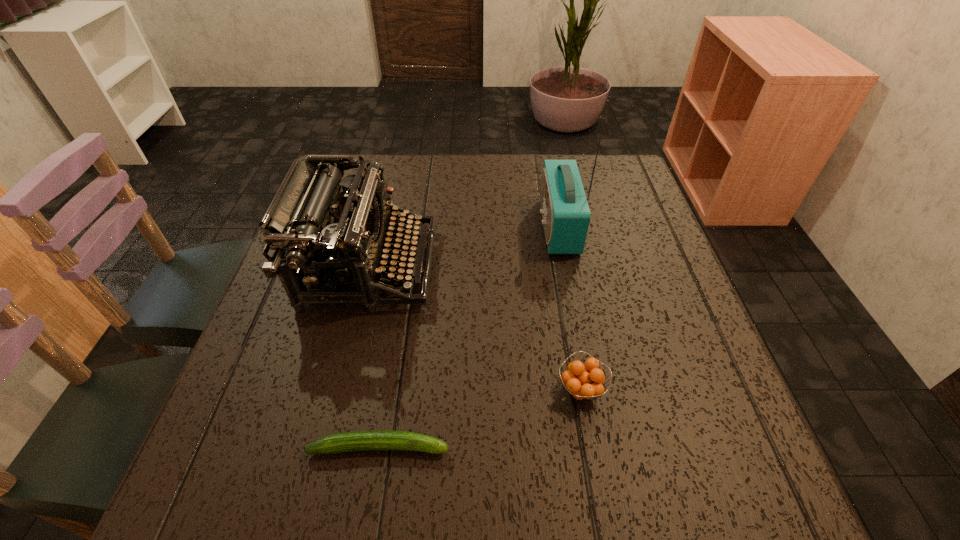
Identify the location of object that ranks as the third closest to the tallest object. (358, 440).

This screenshot has width=960, height=540. I want to click on object that is the third closest to the third shortest object, so click(x=584, y=382).

Where is `vacant space that satisfies the following two spatial constraints: 1. on the front side of the second nearest object; 2. on the front-facing side of the shortest object`? Image resolution: width=960 pixels, height=540 pixels. vacant space that satisfies the following two spatial constraints: 1. on the front side of the second nearest object; 2. on the front-facing side of the shortest object is located at coordinates (591, 447).

The width and height of the screenshot is (960, 540). Find the location of `free space in the image that satisfies the following two spatial constraints: 1. on the typing side of the second tallest object; 2. on the right side of the second nearest object`. free space in the image that satisfies the following two spatial constraints: 1. on the typing side of the second tallest object; 2. on the right side of the second nearest object is located at coordinates (339, 389).

Where is `vacant point that satisfies the following two spatial constraints: 1. on the typing side of the orange fruit; 2. on the left side of the typewriter`? vacant point that satisfies the following two spatial constraints: 1. on the typing side of the orange fruit; 2. on the left side of the typewriter is located at coordinates (x=339, y=389).